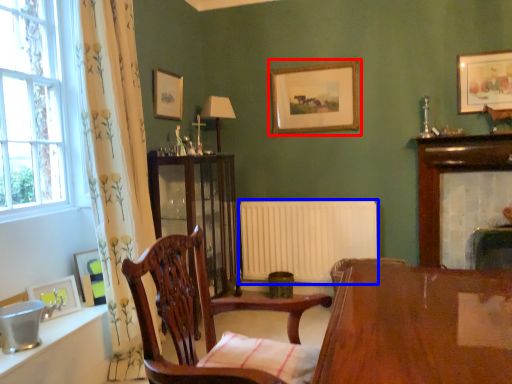
Question: Which object is closer to the camera taking this photo, picture frame (highlighted by a red box) or radiator (highlighted by a blue box)?

Choices:
 (A) picture frame
 (B) radiator

Answer: (A)